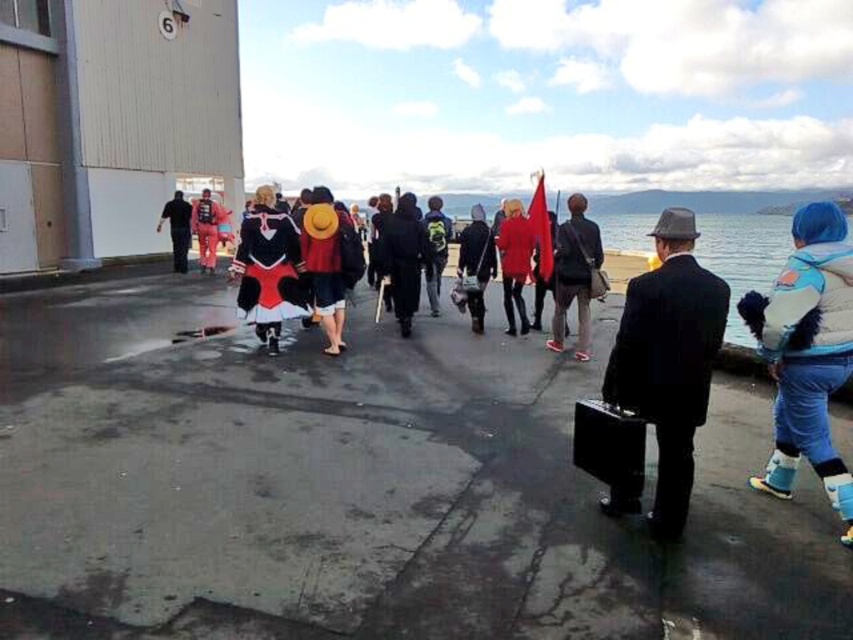
Is glossy asphalt tarmac at center above black matte coat at center?

No, glossy asphalt tarmac at center is not above black matte coat at center.

Does glossy asphalt tarmac at center come behind black matte coat at center?

No, it is not.

Is point (155, 374) positioned behind point (395, 252)?

No, it is in front of (395, 252).

You are a GUI agent. You are given a task and a screenshot of the screen. Output one action in this format:
    pyautogui.click(x=<x>, y=<y>)
    Task: Click on the glossy asphalt tarmac at center
    
    Given the screenshot: What is the action you would take?
    pyautogui.click(x=361, y=492)

Does point (474, 250) lie behind point (172, 200)?

That is False.

Which of these two, matte black jacket at center or black matte suit at left, stands shorter?

matte black jacket at center

Does point (479, 250) come in front of point (189, 221)?

Yes, point (479, 250) is closer to viewer.

The width and height of the screenshot is (853, 640). In order to click on matte black jacket at center in this screenshot , I will do `click(474, 266)`.

Does orange jumpsuit at center have a larger size compared to black matte suit at left?

Yes, orange jumpsuit at center is bigger than black matte suit at left.

Is the position of orange jumpsuit at center less distant than that of black matte suit at left?

Yes.

What do you see at coordinates (209, 228) in the screenshot? I see `orange jumpsuit at center` at bounding box center [209, 228].

This screenshot has height=640, width=853. I want to click on orange jumpsuit at center, so click(209, 228).